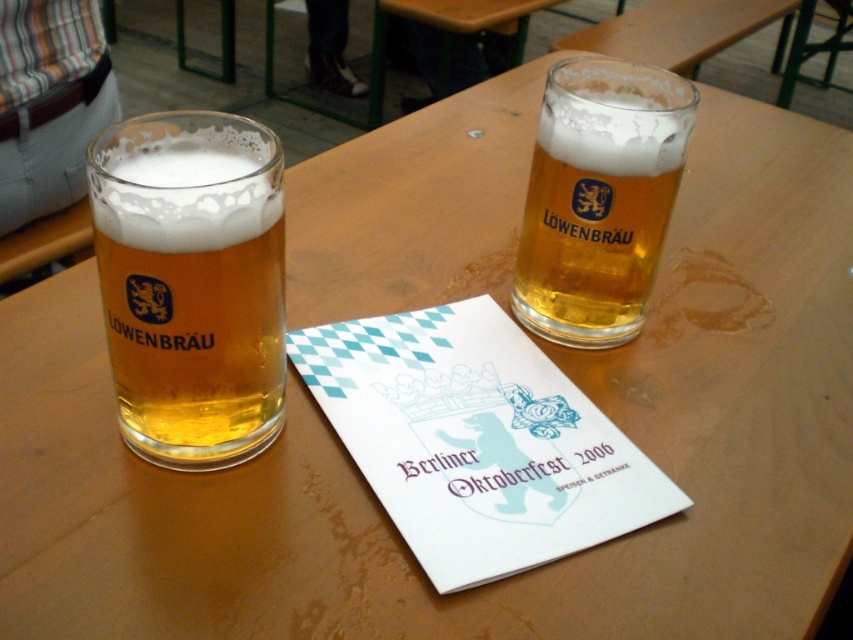
Can you confirm if translucent glass mug at left is positioned below golden glass beer at upper right?

Yes.

The width and height of the screenshot is (853, 640). Describe the element at coordinates (190, 284) in the screenshot. I see `translucent glass mug at left` at that location.

The height and width of the screenshot is (640, 853). I want to click on translucent glass mug at left, so click(190, 284).